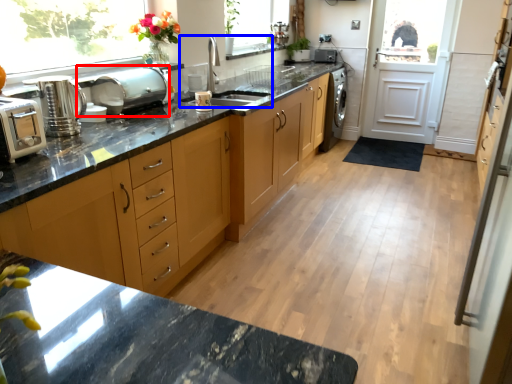
Question: Among these objects, which one is nearest to the camera, appliance (highlighted by a red box) or sink (highlighted by a blue box)?

Choices:
 (A) appliance
 (B) sink

Answer: (A)